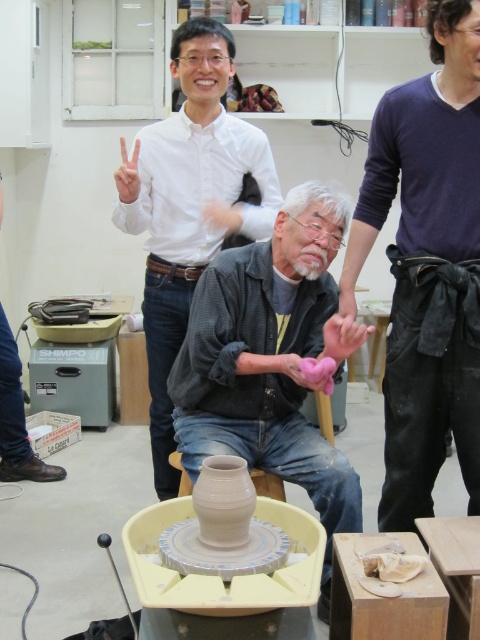
You are a customer in a clothing store and see two sweaters displayed on a mannequin in the center of the store. The dark blue sweater at center and the matte gray sweater at center. Which sweater is placed higher on the mannequin?

The dark blue sweater at center is located above the matte gray sweater at center, so it is placed higher on the mannequin.

In the scene shown: You are a photographer in the pottery workshop and want to take a photo of the dark blue sweater at center and the matte gray sweater at center. Which sweater should you focus on first if you want to capture the one that is taller?

The dark blue sweater at center is much taller than the matte gray sweater at center, so you should focus on the dark blue sweater at center first to capture its height in the photo.